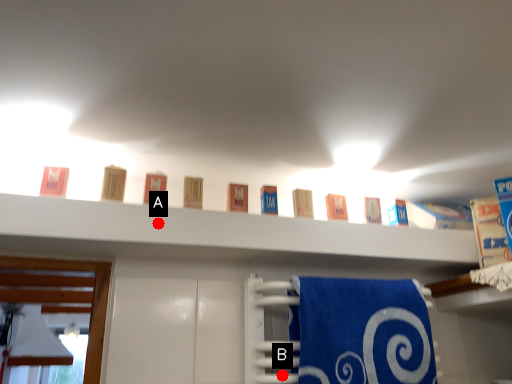
Question: Two points are circled on the image, labeled by A and B beside each circle. Among these points, which one is farthest from the camera?

Choices:
 (A) A is further
 (B) B is further

Answer: (B)